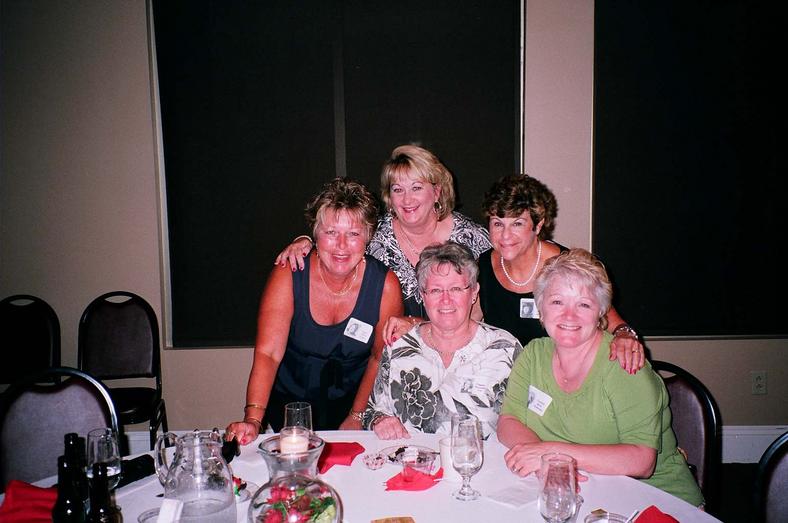
Locate an element on the screen. outlet is located at coordinates (757, 382).